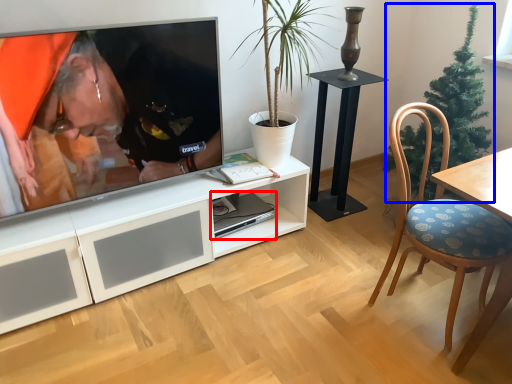
Question: Which of the following is the farthest to the observer, computer (highlighted by a red box) or christmas tree (highlighted by a blue box)?

Choices:
 (A) computer
 (B) christmas tree

Answer: (A)